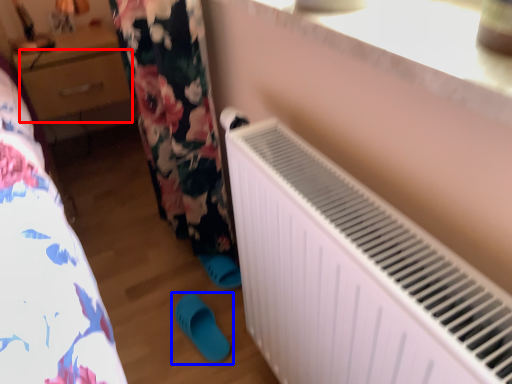
Question: Among these objects, which one is farthest to the camera, drawer (highlighted by a red box) or footwear (highlighted by a blue box)?

Choices:
 (A) drawer
 (B) footwear

Answer: (A)